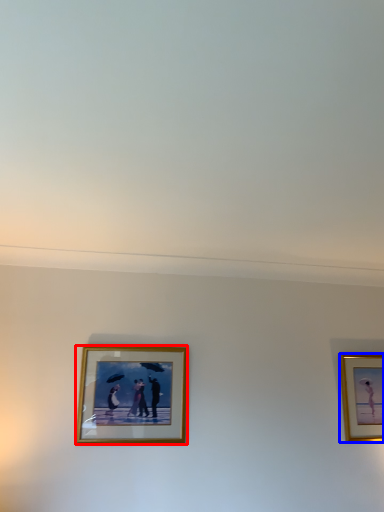
Question: Which of the following is the closest to the observer, picture frame (highlighted by a red box) or picture frame (highlighted by a blue box)?

Choices:
 (A) picture frame
 (B) picture frame

Answer: (A)